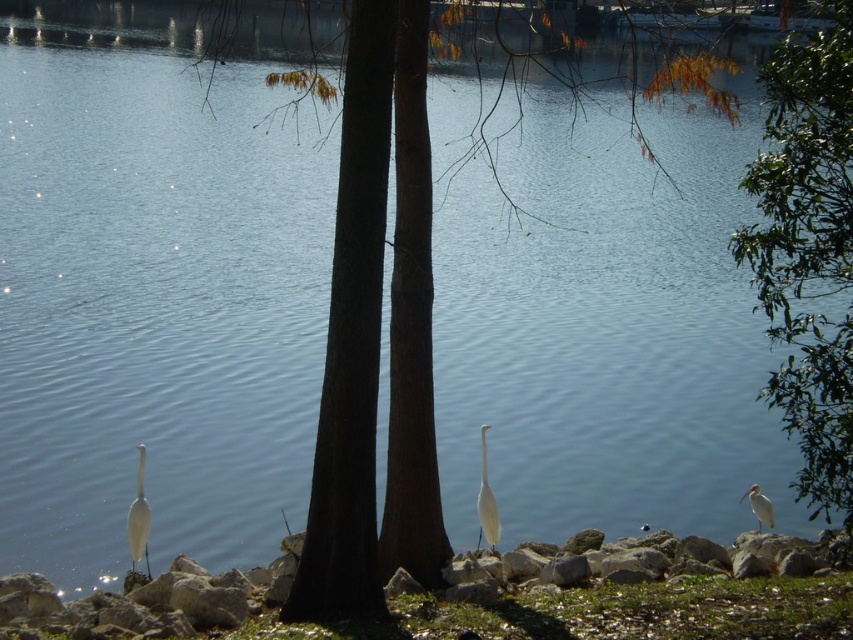
You are an ornithologist observing two white matte birds in the scene. Which of the two birds, the white matte bird at center or the white matte bird at lower right, has a more slender body?

The white matte bird at center is thinner than the white matte bird at lower right, so it has a more slender body.

Based on the coordinates provided in the scene, where is the green leafy tree at lower right located?

The green leafy tree at lower right is located at point (808, 252).

From the picture: You are an ornithologist observing two white matte birds in a lakeside scene. The scene includes a white matte bird at center and a white matte bird at lower right. Which of these birds appears larger in size?

The white matte bird at center appears larger in size compared to the white matte bird at lower right according to the description.